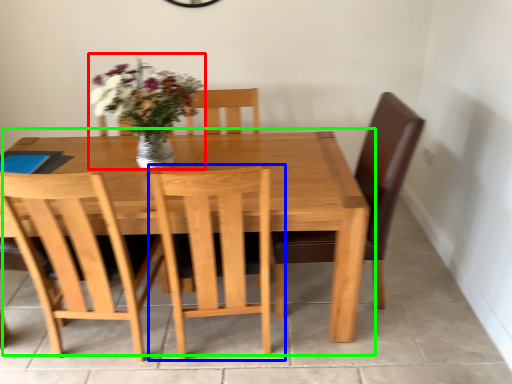
Question: Which object is the farthest from floral arrangement (highlighted by a red box)? Choose among these: chair (highlighted by a blue box) or kitchen & dining room table (highlighted by a green box).

Choices:
 (A) chair
 (B) kitchen & dining room table

Answer: (A)